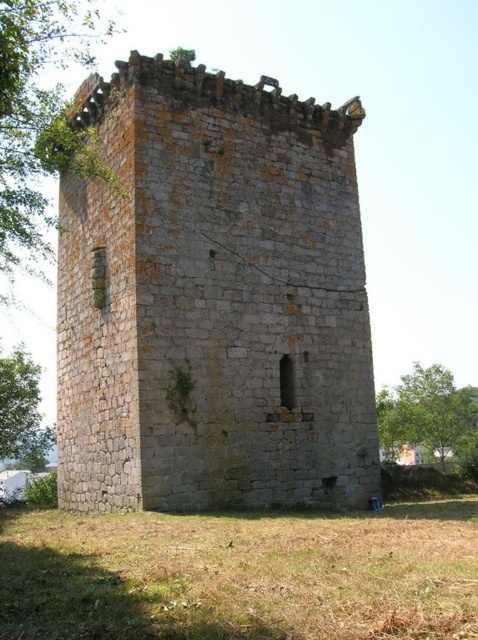
Looking at this image, you are standing at the origin point of the coordinate system, which is at the bottom left corner of the image. You want to walk directly towards the gray stone tower at center. In which direction should you head?

Since the gray stone tower at center is located at coordinate point 0.469 on the x axis and 0.446 on the y axis, you should head northeast to reach it.

You are standing at the base of the tower and see two points marked on the tower. The first point is at coordinate point (86, 259) and the second is at point (29, 449). Which point is closer to you?

Point (86, 259) is in front of point (29, 449), so the first point is closer to you.